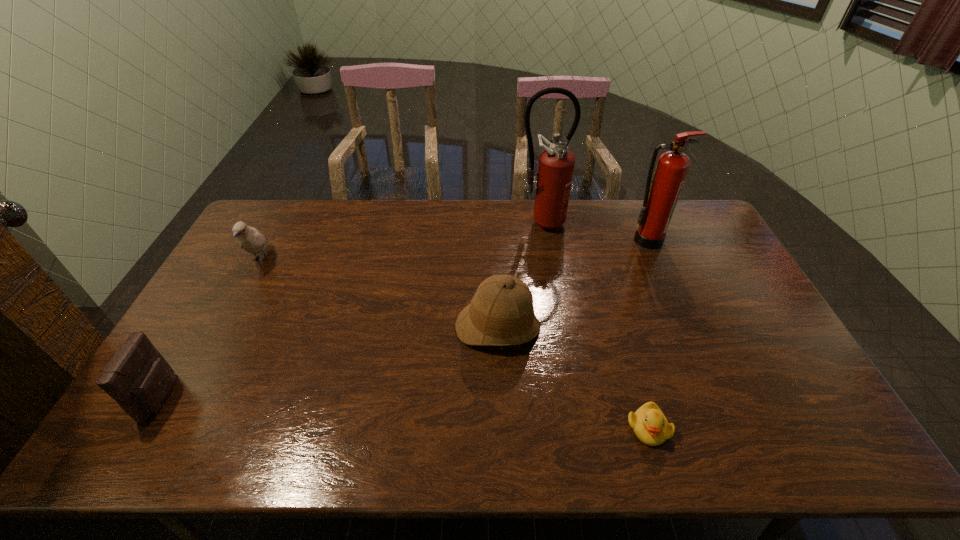
Locate an element on the screen. This screenshot has height=540, width=960. the taller fire extinguisher is located at coordinates (556, 164).

This screenshot has height=540, width=960. What are the coordinates of `the tallest object` in the screenshot? It's located at (556, 164).

Identify the location of the fifth shortest object. (662, 193).

Find the location of a particular element. the shorter fire extinguisher is located at coordinates (662, 193).

Where is `the fourth farthest object`? This screenshot has width=960, height=540. the fourth farthest object is located at coordinates (501, 313).

The height and width of the screenshot is (540, 960). Identify the location of bird. (250, 239).

You are a GUI agent. You are given a task and a screenshot of the screen. Output one action in this format:
    pyautogui.click(x=<x>, y=<y>)
    Task: Click on the leftmost object
    This screenshot has width=960, height=540.
    Given the screenshot: What is the action you would take?
    pyautogui.click(x=138, y=378)

I want to click on the shortest object, so click(x=649, y=424).

Identify the location of the second object from right to left. pos(649,424).

Identify the location of vacant space situated 0.290m at the nozzle of the taller fire extinguisher. (552, 292).